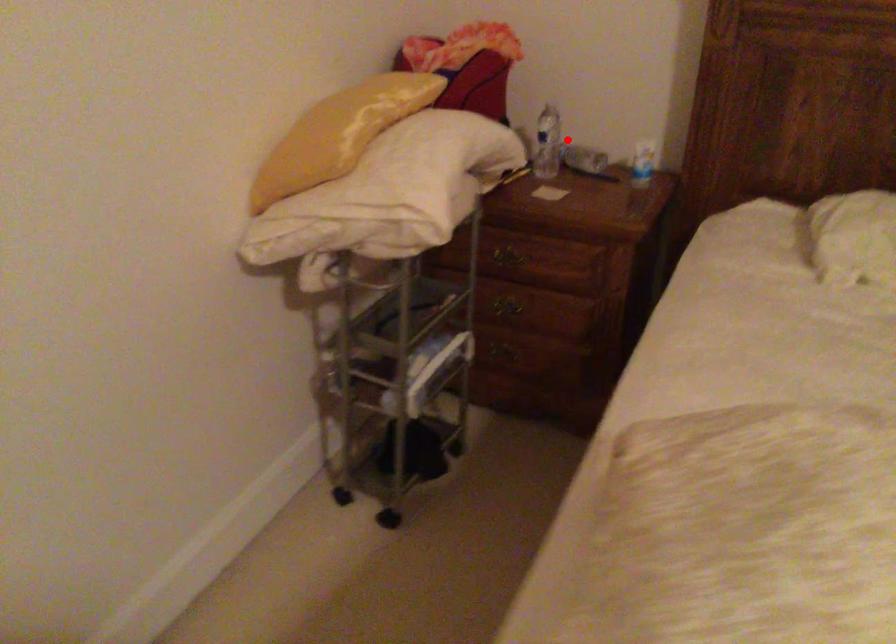
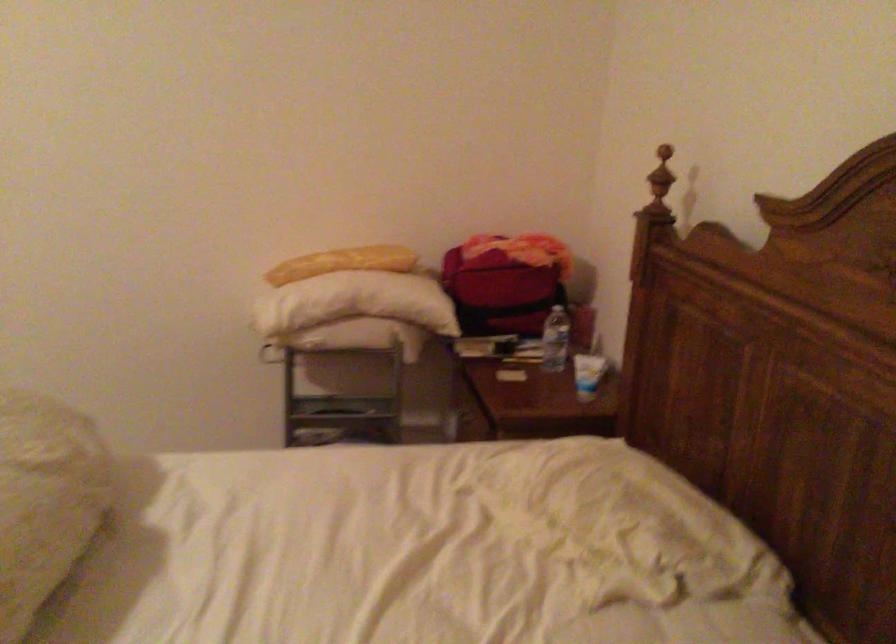
In the second image, find the point that corresponds to the highlighted location in the first image.

(556, 339)